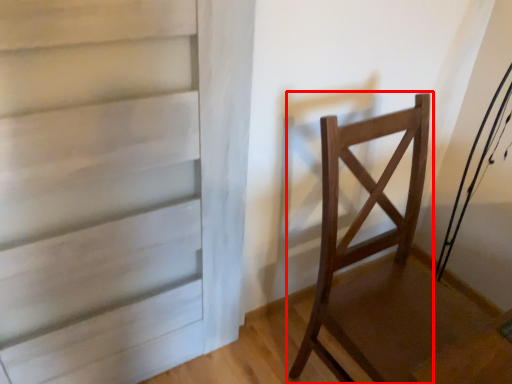
Question: Considering the relative positions of chair (annotated by the red box) and door in the image provided, where is chair (annotated by the red box) located with respect to the staircase?

Choices:
 (A) right
 (B) left

Answer: (A)